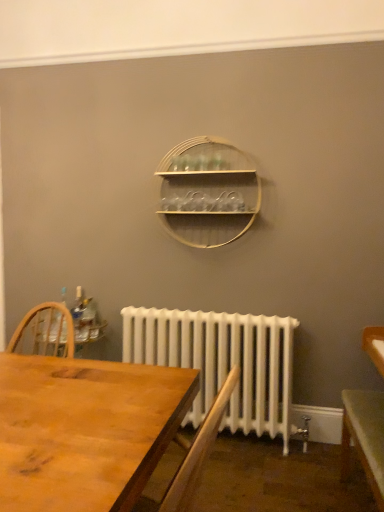
Question: Is wooden at center to the left or to the right of white painted radiator at lower center in the image?

Choices:
 (A) right
 (B) left

Answer: (B)

Question: Considering the positions of wooden at center and white painted radiator at lower center in the image, is wooden at center taller or shorter than white painted radiator at lower center?

Choices:
 (A) short
 (B) tall

Answer: (A)

Question: Estimate the real-world distances between objects in this image. Which object is closer to the clear plastic bottle at left?

Choices:
 (A) green matte table at lower right
 (B) white painted radiator at lower center
 (C) wooden at center
 (D) wooden desk at center

Answer: (B)

Question: Which of these objects is positioned closest to the clear plastic bottle at left?

Choices:
 (A) wooden at center
 (B) green matte table at lower right
 (C) white painted radiator at lower center
 (D) wooden desk at center

Answer: (C)